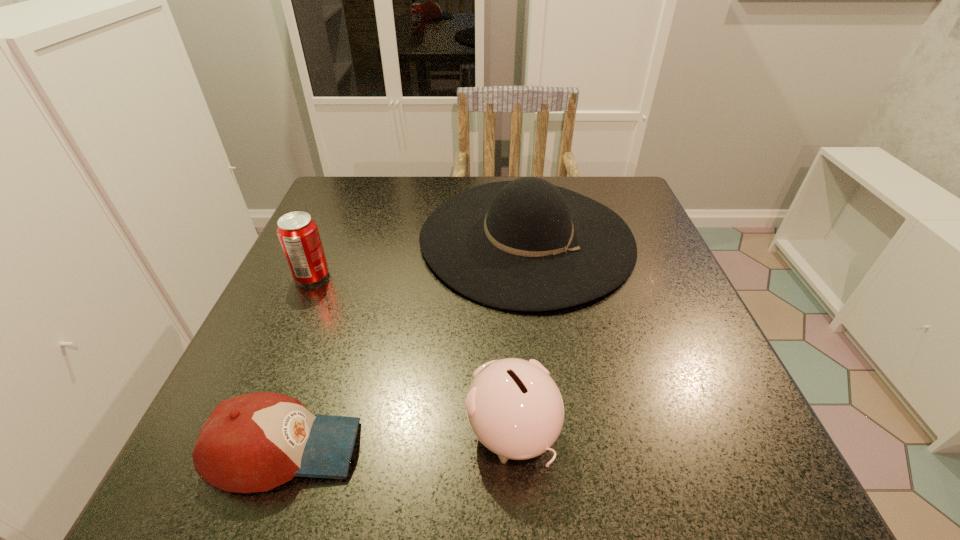
This screenshot has height=540, width=960. I want to click on sombrero, so click(x=527, y=245).

At what (x,y) coordinates should I click in order to perform the action: click on soda. Please return your answer as a coordinate pair (x, y). The height and width of the screenshot is (540, 960). Looking at the image, I should click on (298, 234).

Locate an element on the screen. The height and width of the screenshot is (540, 960). piggy bank is located at coordinates (515, 409).

In order to click on the shortest object in this screenshot , I will do `click(254, 442)`.

Where is `free space located on the front-facing side of the sombrero`? free space located on the front-facing side of the sombrero is located at coordinates (558, 465).

Find the location of a particular element. The image size is (960, 540). free location located on the right of the soda is located at coordinates (465, 276).

Image resolution: width=960 pixels, height=540 pixels. Identify the location of vacant point located 0.350m on the back of the piggy bank. (501, 253).

Locate an element on the screen. Image resolution: width=960 pixels, height=540 pixels. blank space located 0.350m on the front-facing side of the shortest object is located at coordinates (604, 449).

Identify the location of object that is at the far edge. (527, 245).

The image size is (960, 540). What are the coordinates of `piggy bank that is positioned at the near edge` in the screenshot? It's located at (515, 409).